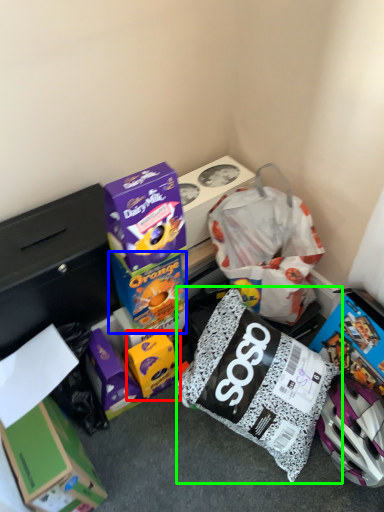
Question: Which object is the farthest from box (highlighted by a red box)? Choose among these: box (highlighted by a blue box) or diaper bag (highlighted by a green box).

Choices:
 (A) box
 (B) diaper bag

Answer: (B)